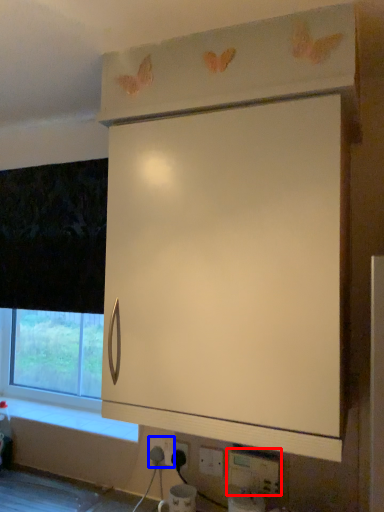
Question: Which of the following is the farthest to the observer, electric outlet (highlighted by a red box) or electric outlet (highlighted by a blue box)?

Choices:
 (A) electric outlet
 (B) electric outlet

Answer: (B)